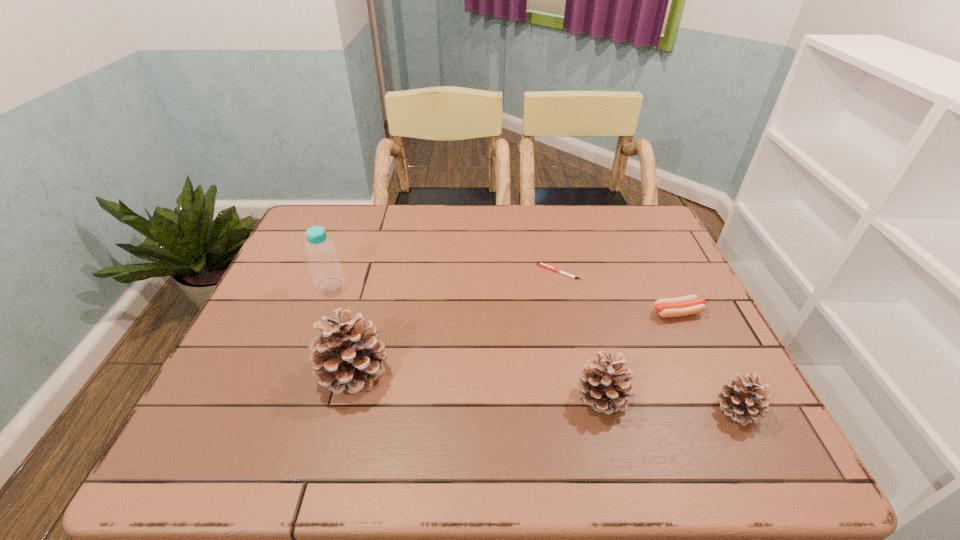
Find the location of a particular element. The width and height of the screenshot is (960, 540). free spot located 0.140m on the back of the second object from left to right is located at coordinates (372, 303).

Where is `free region located 0.240m on the right of the third tallest object`? The width and height of the screenshot is (960, 540). free region located 0.240m on the right of the third tallest object is located at coordinates (742, 396).

Identify the location of free space located 0.380m on the left of the fourth tallest object. (532, 409).

I want to click on free location located 0.380m on the back of the bottle, so click(x=361, y=204).

Image resolution: width=960 pixels, height=540 pixels. I want to click on vacant space situated 0.110m on the back of the sausage, so pyautogui.click(x=660, y=276).

This screenshot has height=540, width=960. What are the coordinates of `blank area located on the clicker of the pen` in the screenshot? It's located at (514, 272).

Locate an element on the screen. vacant space situated on the clicker of the pen is located at coordinates (449, 272).

This screenshot has height=540, width=960. Identify the location of free location located 0.090m on the clicker of the pen. 506,272.

This screenshot has height=540, width=960. In order to click on object present at the left edge in this screenshot , I will do `click(325, 267)`.

Image resolution: width=960 pixels, height=540 pixels. Identify the location of pinecone situated at the right edge. (742, 399).